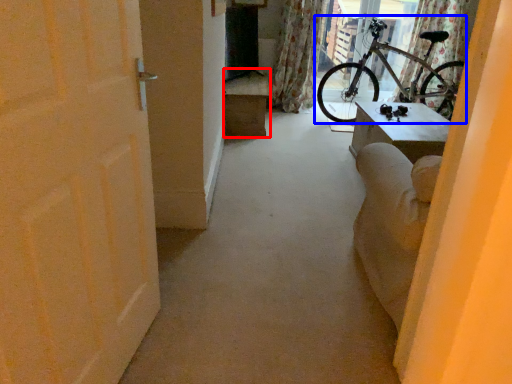
Question: Which object appears farthest to the camera in this image, furniture (highlighted by a red box) or bicycle (highlighted by a blue box)?

Choices:
 (A) furniture
 (B) bicycle

Answer: (A)